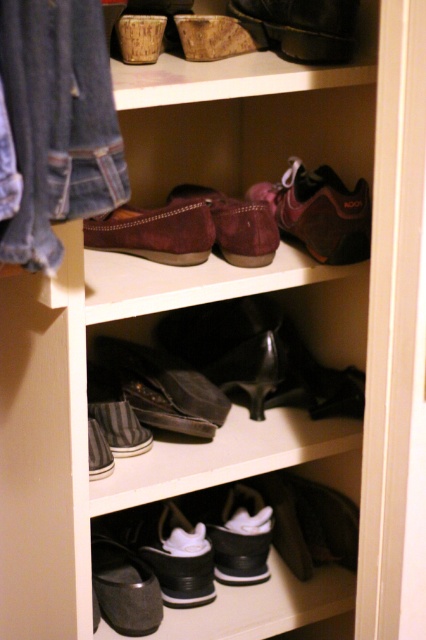
Who is more distant from viewer, (362, 209) or (275, 0)?

Point (275, 0)

Consider the image. Which is more to the left, suede/maroon shoe at center or leather boot at upper center?

leather boot at upper center is more to the left.

The height and width of the screenshot is (640, 426). Identify the location of suede/maroon shoe at center. (319, 211).

Who is higher up, dark gray suede shoe at lower left or suede/matte shoe at center?

suede/matte shoe at center

How far apart are dark gray suede shoe at lower left and suede/matte shoe at center?

dark gray suede shoe at lower left and suede/matte shoe at center are 27.42 inches apart.

At what (x,y) coordinates should I click in order to perform the action: click on dark gray suede shoe at lower left. Please return your answer as a coordinate pair (x, y). Looking at the image, I should click on (124, 588).

Find the location of a particular element. dark gray suede shoe at lower left is located at coordinates (124, 588).

Who is lower down, denim jeans at upper left or suede/maroon shoe at center?

denim jeans at upper left is below.

Between denim jeans at upper left and suede/maroon shoe at center, which one has less height?

With less height is suede/maroon shoe at center.

Is point (37, 147) positioned after point (351, 208)?

No, it is in front of (351, 208).

The image size is (426, 640). Find the location of `denim jeans at upper left`. denim jeans at upper left is located at coordinates (57, 122).